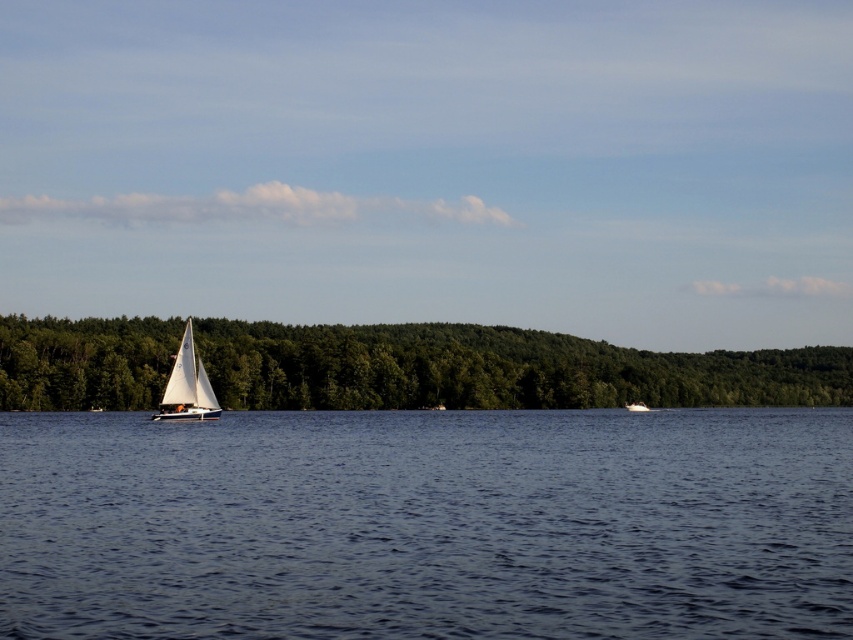
You are standing at the center of the image and want to locate the green leafy trees at left. Which direction should you look to find them?

The green leafy trees at left are located at point coordinates of (x=495, y=369), so you should look to your left to find them.

You are standing on the lakeside dock and see the blue water at center and the white glossy boat at center. Which object is positioned higher in the image?

The blue water at center is located above the white glossy boat at center, so the blue water at center is higher in the image.

You are a photographer trying to capture the white glossy boat at center and the green leafy trees at left in your shot. Based on their sizes in the image, which object appears larger?

The green leafy trees at left appear larger than the white glossy boat at center in the image.